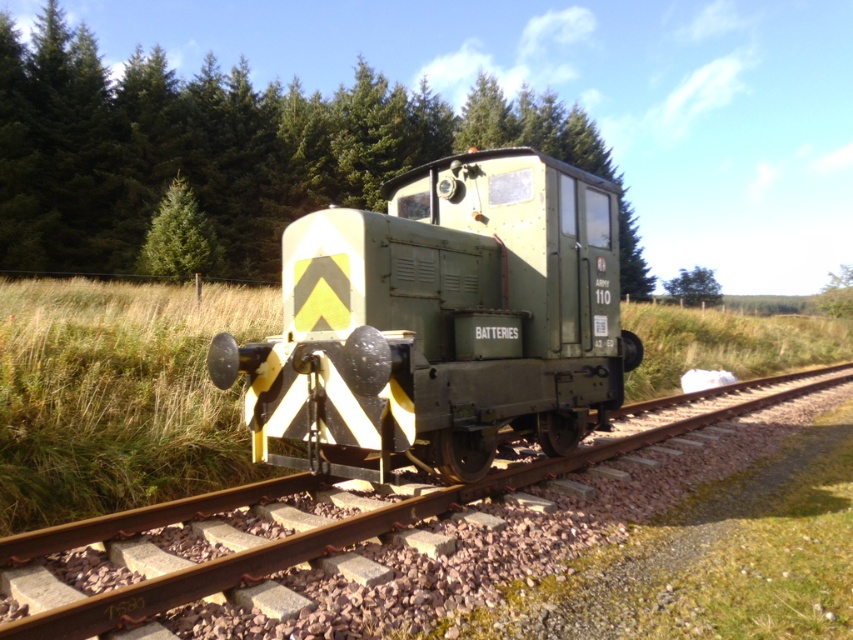
Between green textured pine tree at upper left and green leafy tree at upper right, which one is positioned higher?

green textured pine tree at upper left

You are a GUI agent. You are given a task and a screenshot of the screen. Output one action in this format:
    pyautogui.click(x=<x>, y=<y>)
    Task: Click on the green textured pine tree at upper left
    The image size is (853, 640).
    Given the screenshot: What is the action you would take?
    pyautogui.click(x=178, y=237)

Locate an element on the screen. The image size is (853, 640). green textured pine tree at upper left is located at coordinates (178, 237).

Which of these two, matte green train at center or yellow/black striped track at center, stands taller?

yellow/black striped track at center

Can you confirm if matte green train at center is bigger than yellow/black striped track at center?

Incorrect, matte green train at center is not larger than yellow/black striped track at center.

At what (x,y) coordinates should I click in order to perform the action: click on matte green train at center. Please return your answer as a coordinate pair (x, y). Looking at the image, I should click on (442, 320).

Does matte green train at center appear over green grass at center?

No, matte green train at center is not above green grass at center.

Does matte green train at center appear on the right side of green grass at center?

Incorrect, matte green train at center is not on the right side of green grass at center.

Between point (561, 195) and point (86, 492), which one is positioned behind?

The point (561, 195) is more distant.

Find the location of a particular element. matte green train at center is located at coordinates (442, 320).